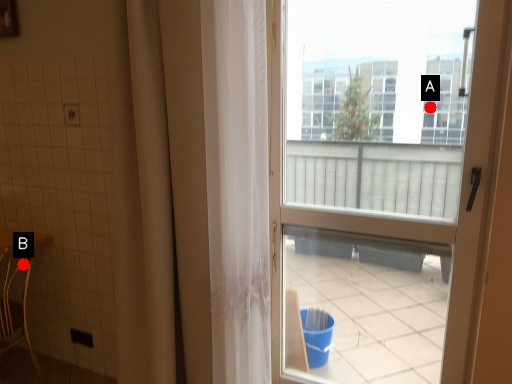
Question: Two points are circled on the image, labeled by A and B beside each circle. Among these points, which one is farthest from the camera?

Choices:
 (A) A is further
 (B) B is further

Answer: (B)